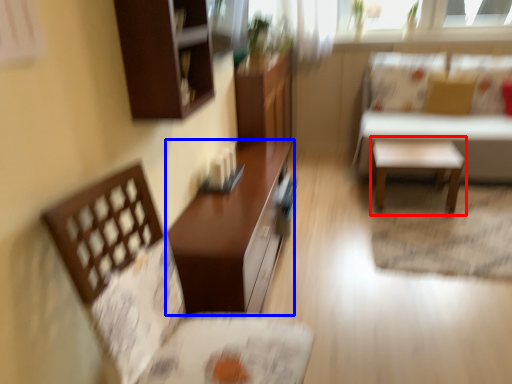
Question: Which point is closer to the camera, side table (highlighted by a red box) or table (highlighted by a blue box)?

Choices:
 (A) side table
 (B) table

Answer: (B)